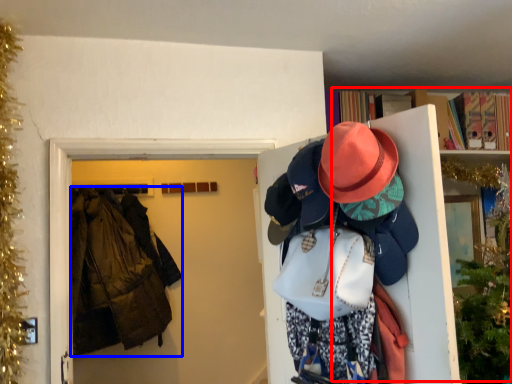
Question: Which point is closer to the camera, bookcase (highlighted by a red box) or jacket (highlighted by a blue box)?

Choices:
 (A) bookcase
 (B) jacket

Answer: (A)